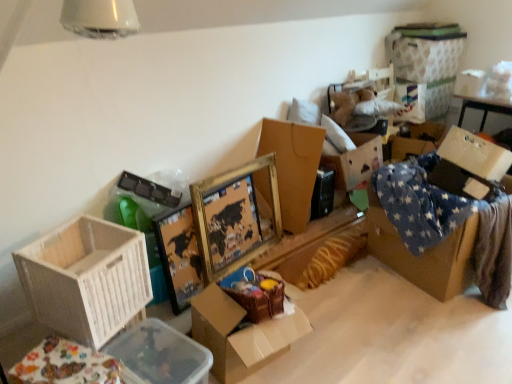
The image size is (512, 384). I want to click on free space above clear plastic container at lower left, arranged as the third storage box when viewed from the back (from a real-world perspective), so click(x=145, y=351).